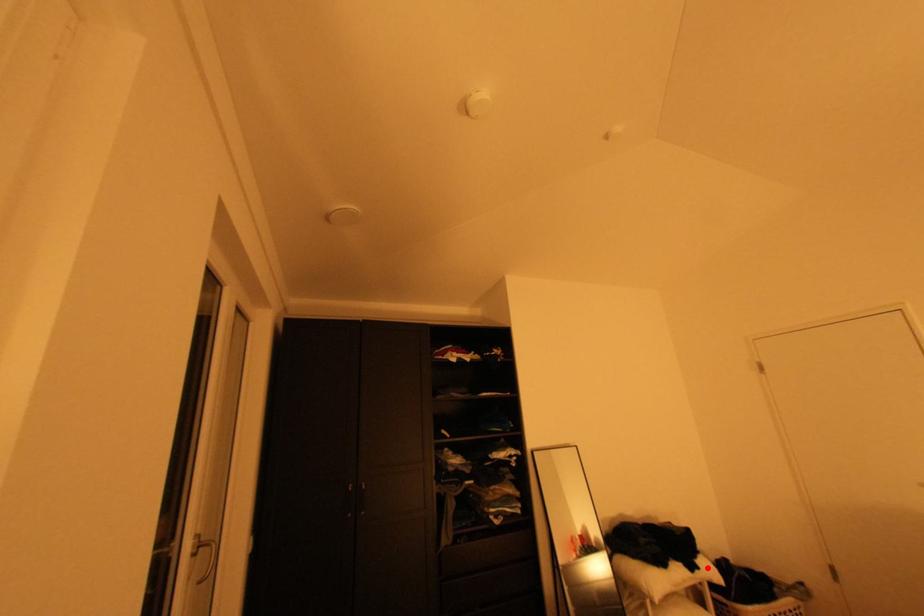
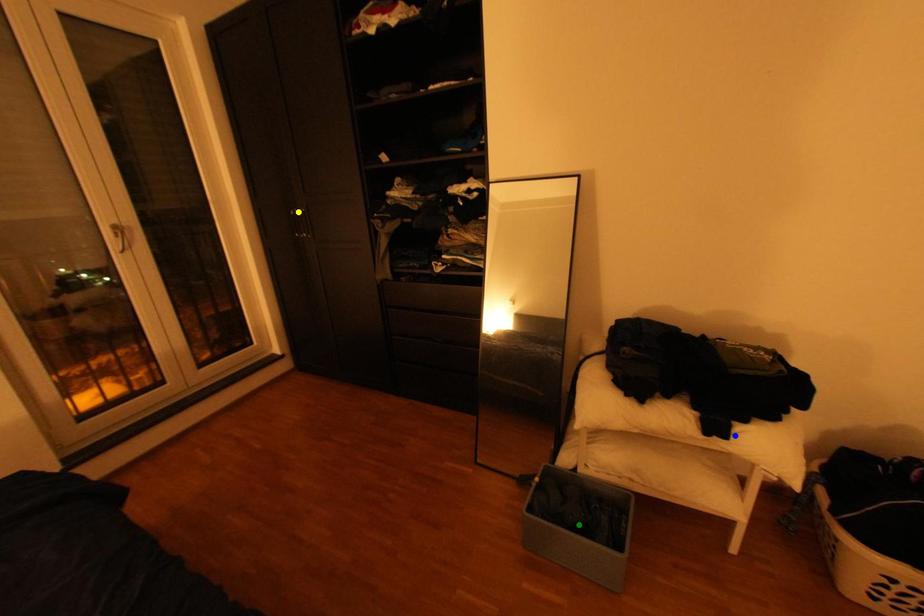
Question: I am providing you with two images of the same scene from different viewpoints. A red point is marked on the first image. You are given multiple points on the second image. In image 2, which mark is for the same physical point as the one in image 1?

Choices:
 (A) green point
 (B) yellow point
 (C) blue point

Answer: (C)